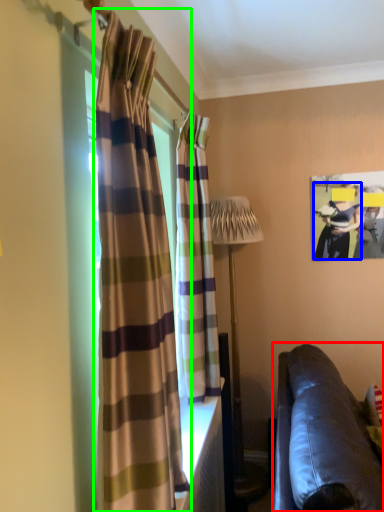
Question: Based on their relative distances, which object is nearer to studio couch (highlighted by a red box)? Choose from person (highlighted by a blue box) and curtain (highlighted by a green box).

Choices:
 (A) person
 (B) curtain

Answer: (B)